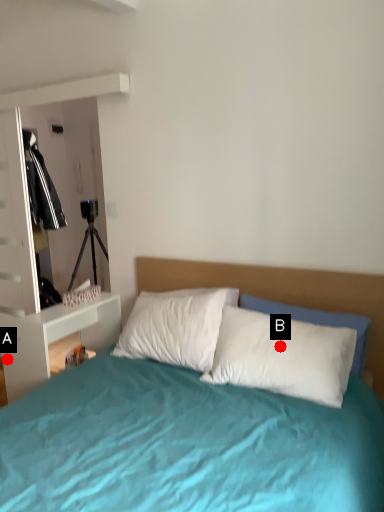
Question: Two points are circled on the image, labeled by A and B beside each circle. Which point is farther from the camera taking this photo?

Choices:
 (A) A is further
 (B) B is further

Answer: (A)